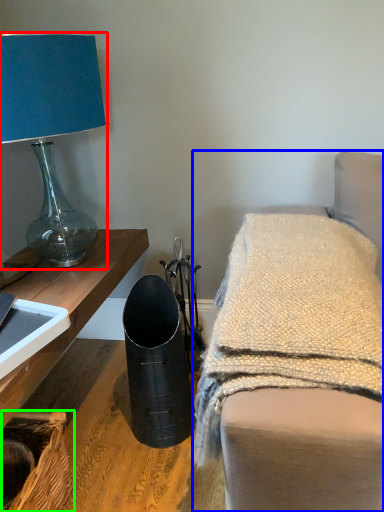
Question: Which is farther away from lamp (highlighted by a red box)? furniture (highlighted by a blue box) or basket (highlighted by a green box)?

Choices:
 (A) furniture
 (B) basket

Answer: (B)